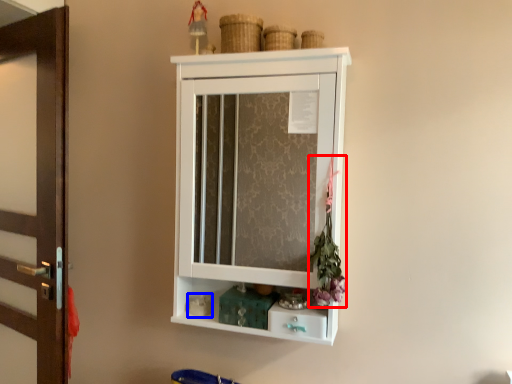
Question: Which of the following is the closest to the observer, flower (highlighted by a red box) or toy (highlighted by a blue box)?

Choices:
 (A) flower
 (B) toy

Answer: (A)